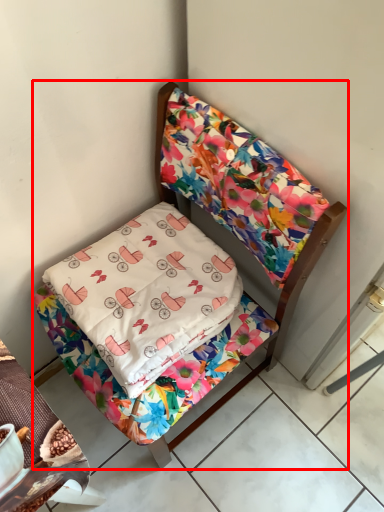
Question: Where is furniture (annotated by the red box) located in relation to pillow in the image?

Choices:
 (A) right
 (B) left

Answer: (A)